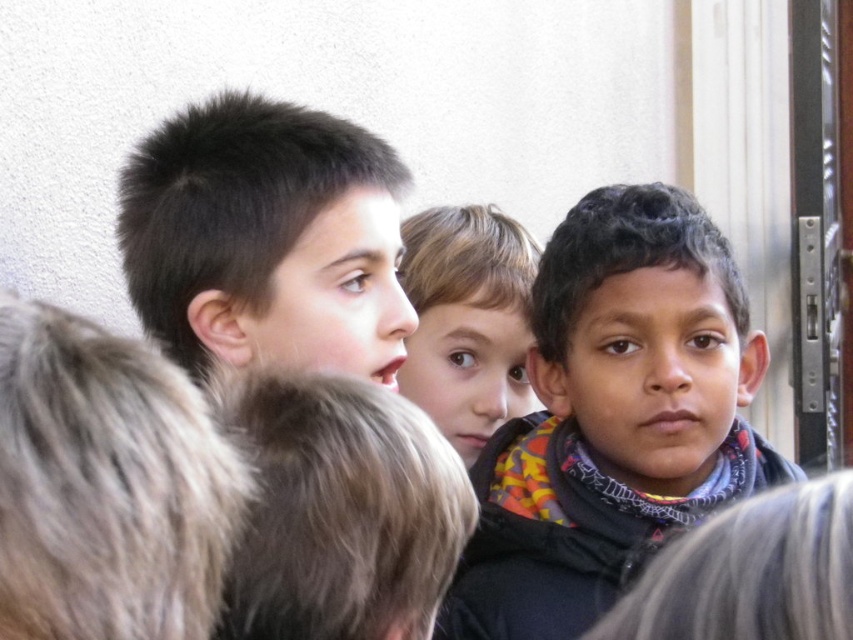
Question: Which point appears closest to the camera in this image?

Choices:
 (A) (242, 157)
 (B) (680, 333)
 (C) (514, 365)

Answer: (A)

Question: Which point is closer to the camera taking this photo?

Choices:
 (A) (541, 522)
 (B) (467, 317)

Answer: (A)

Question: Can you confirm if dark brown hair at center is positioned to the left of smooth brown hair at center?

Choices:
 (A) no
 (B) yes

Answer: (B)

Question: Does dark brown hair at center come in front of smooth brown hair at center?

Choices:
 (A) no
 (B) yes

Answer: (B)

Question: Can you confirm if multicolored scarf at center is positioned to the left of dark brown hair at center?

Choices:
 (A) no
 (B) yes

Answer: (A)

Question: Which point is closer to the camera taking this photo?

Choices:
 (A) (515, 314)
 (B) (579, 609)
 (C) (233, 204)

Answer: (C)